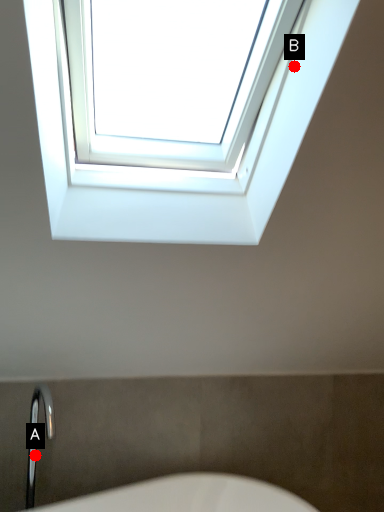
Question: Two points are circled on the image, labeled by A and B beside each circle. Among these points, which one is farthest from the camera?

Choices:
 (A) A is further
 (B) B is further

Answer: (A)